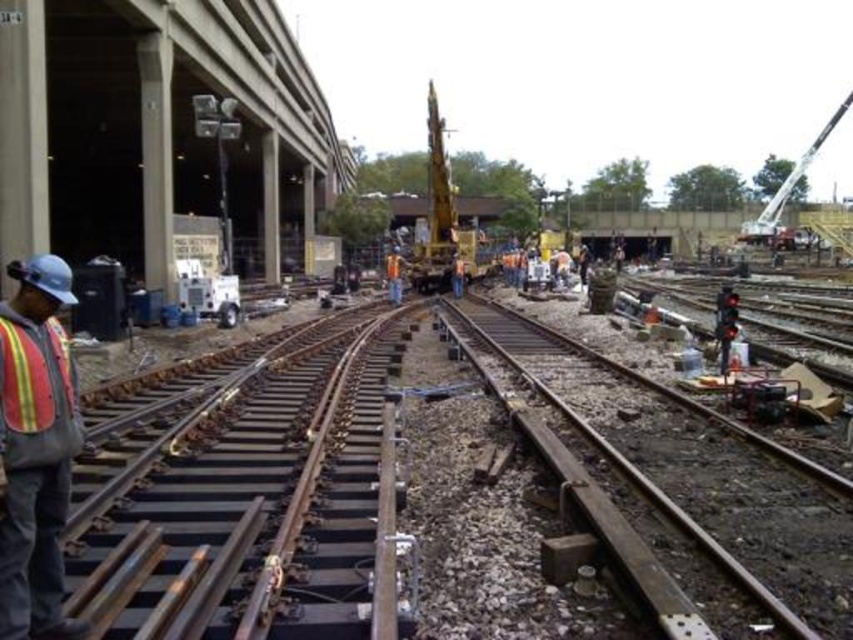
Is smooth metal rail at center above metallic silver crane at upper right?

No.

Where is `smooth metal rail at center`? smooth metal rail at center is located at coordinates (686, 480).

I want to click on smooth metal rail at center, so click(x=686, y=480).

Does smooth metal rail at center appear on the right side of reflective safety vest at left?

Correct, you'll find smooth metal rail at center to the right of reflective safety vest at left.

Does point (683, 493) come in front of point (3, 566)?

That is False.

I want to click on smooth metal rail at center, so click(x=686, y=480).

In the scene shown: Is reflective safety vest at left positioned at the back of metallic silver crane at upper right?

No.

The width and height of the screenshot is (853, 640). Identify the location of reflective safety vest at left. (35, 451).

Image resolution: width=853 pixels, height=640 pixels. What do you see at coordinates (35, 451) in the screenshot?
I see `reflective safety vest at left` at bounding box center [35, 451].

Locate an element on the screen. reflective safety vest at left is located at coordinates click(35, 451).